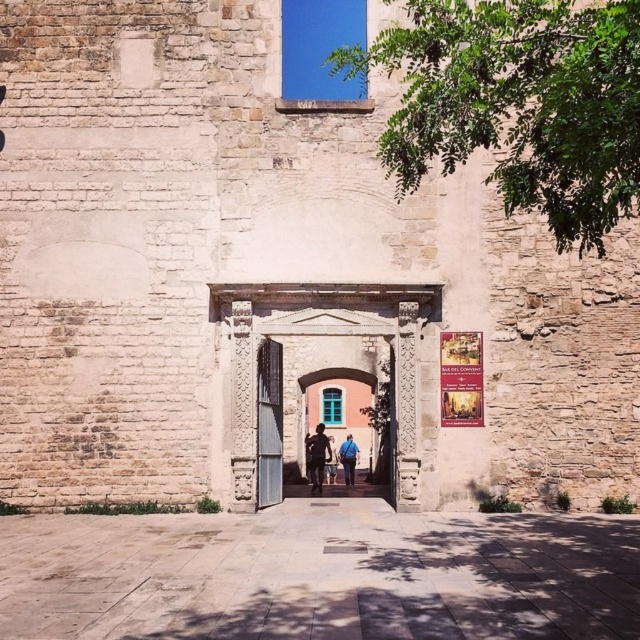
You are standing in front of the historic stone building and want to place two markers at the specified points. Given that you can only place markers in front of the building, can you determine which point, point (305, 387) or point (280, 467), is closer to the building?

Point (280, 467) is closer to the building because it is in front of point (305, 387), which is behind it.

From the picture: You are standing in front of the historic stone building and want to take a photo of both the smooth stone archway at center and the blue fabric backpack at center. Which object should you focus on first to ensure both are in clear view?

You should focus on the smooth stone archway at center first because it is closer to you than the blue fabric backpack at center, so adjusting focus from near to far will help both be in clear view.